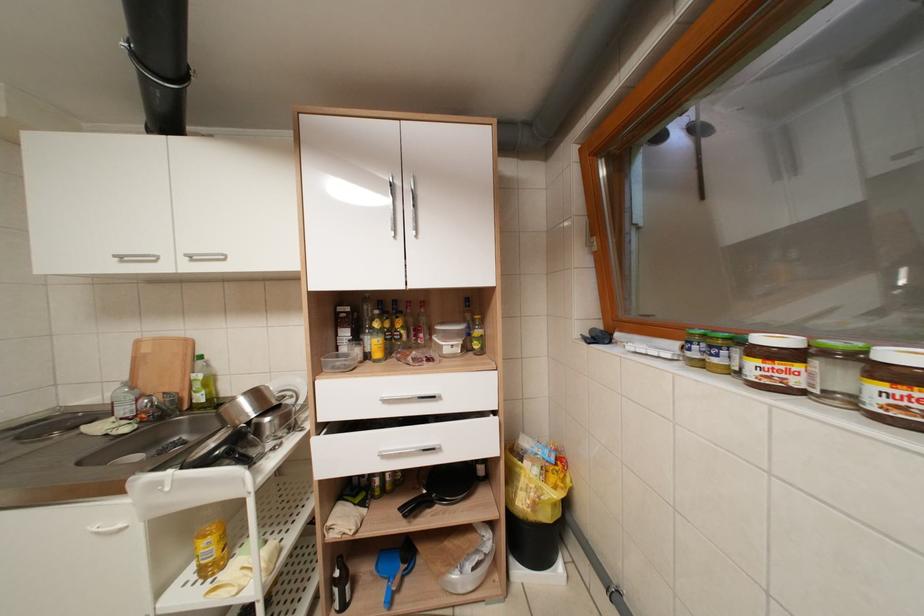
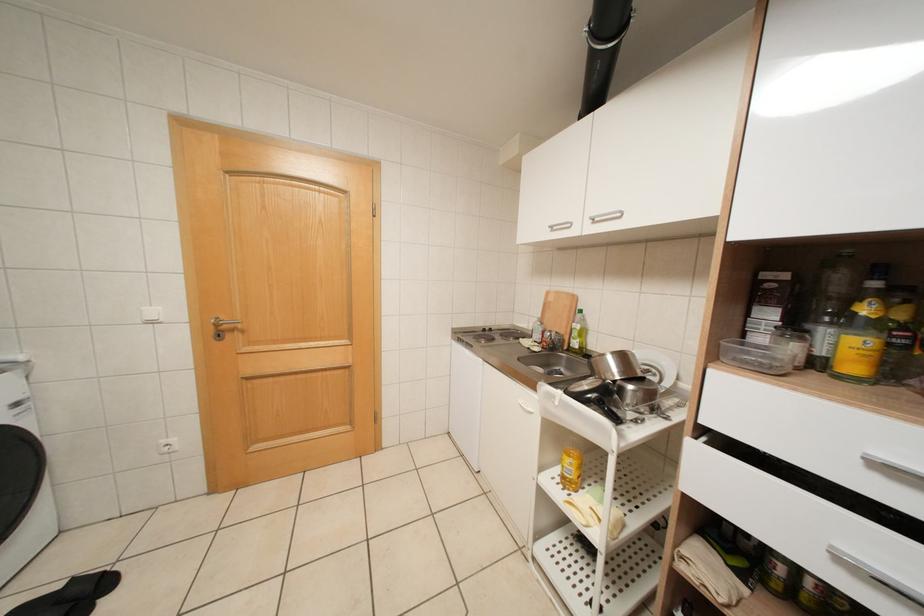
Question: The camera is either moving clockwise (left) or counter-clockwise (right) around the object. The first image is from the beginning of the video and the second image is from the end. Is the camera moving left or right when shooting the video?

Choices:
 (A) Left
 (B) Right

Answer: (B)